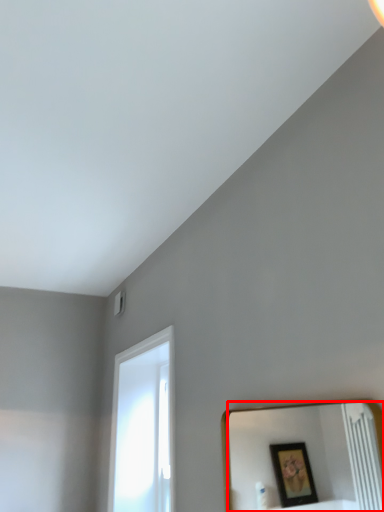
Question: From the image's perspective, what is the correct spatial positioning of mirror (annotated by the red box) in reference to window?

Choices:
 (A) below
 (B) above

Answer: (B)